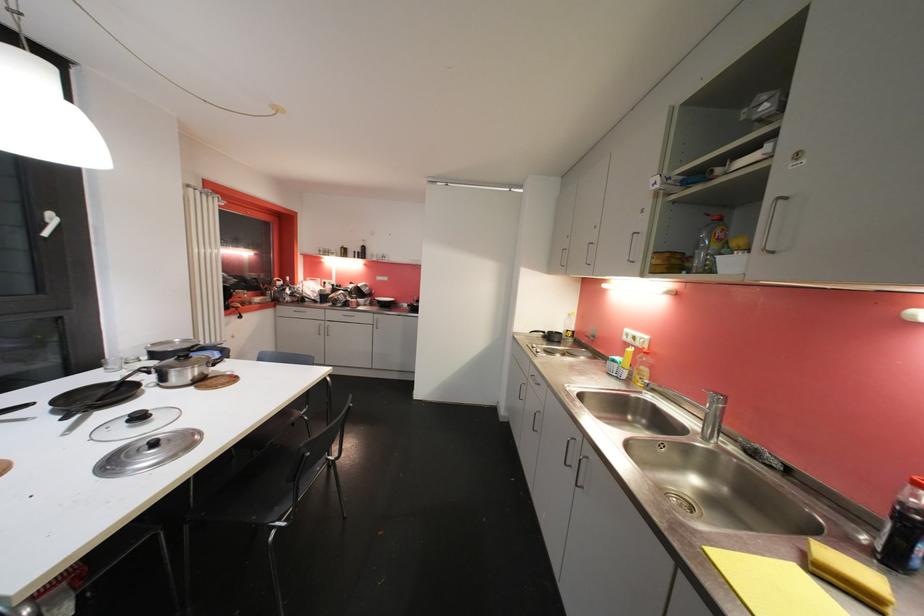
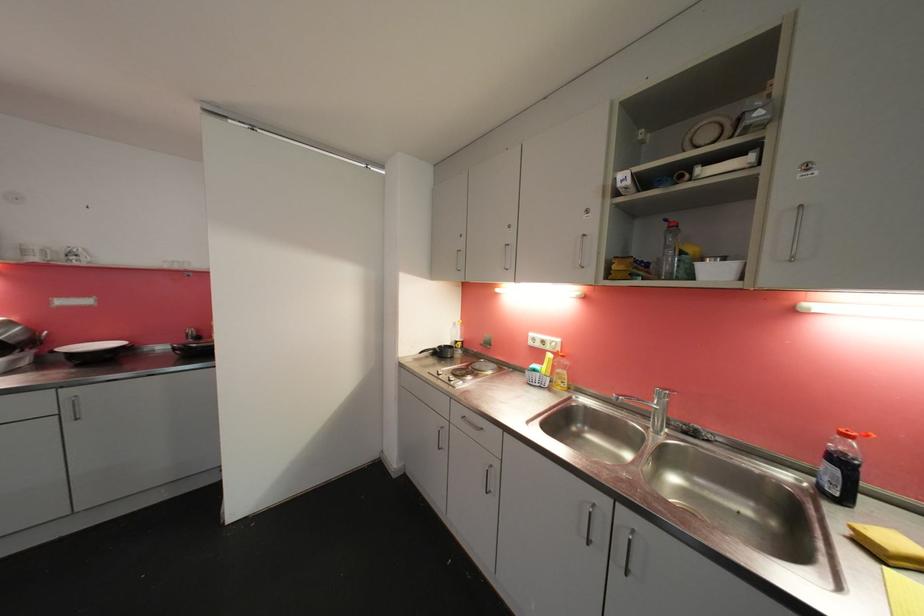
Question: The camera is either moving clockwise (left) or counter-clockwise (right) around the object. The first image is from the beginning of the video and the second image is from the end. Is the camera moving left or right when shooting the video?

Choices:
 (A) Left
 (B) Right

Answer: (A)